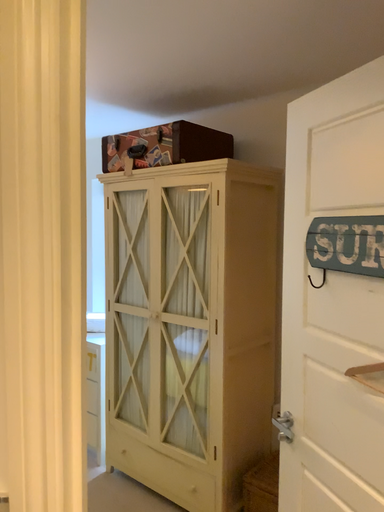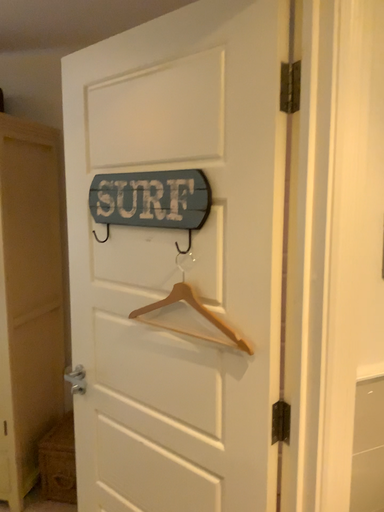
Question: Which way did the camera rotate in the video?

Choices:
 (A) rotated right
 (B) rotated left

Answer: (A)